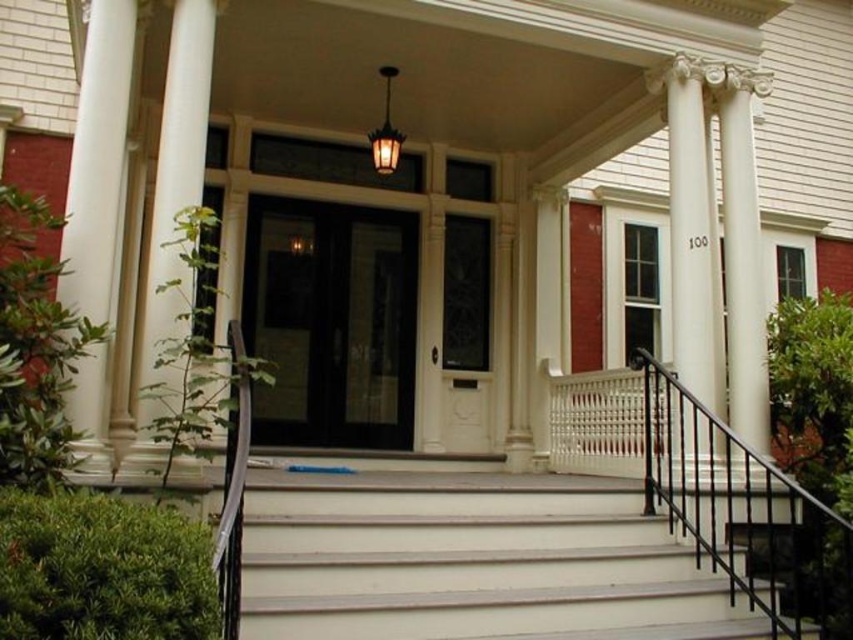
You are a painter hired to paint the columns of the house entrance. You have a limited amount of paint. Which column would require less paint to cover completely, the white smooth column at left or the white smooth column at right?

The white smooth column at left is thinner than the white smooth column at right, so it would require less paint to cover completely.

You are standing at the front yard of the house and want to reach the entrance doors. Which object must you pass first, the white painted wood stairs at center or the white smooth column at right?

The white painted wood stairs at center must be passed first because it is located below the white smooth column at right, meaning the stairs are closer to the entrance area while the column is positioned further back.